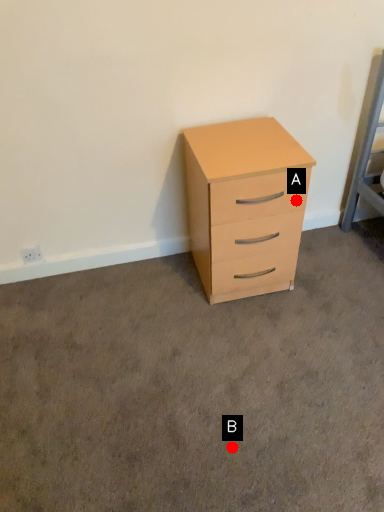
Question: Two points are circled on the image, labeled by A and B beside each circle. Which point is closer to the camera?

Choices:
 (A) A is closer
 (B) B is closer

Answer: (B)